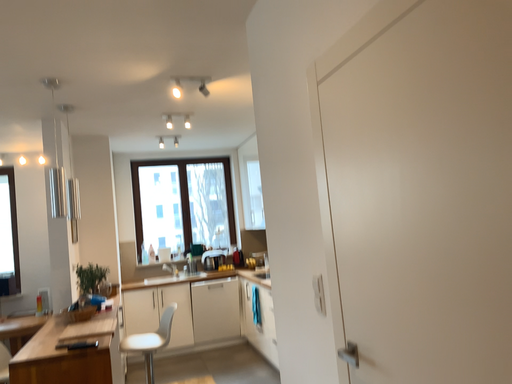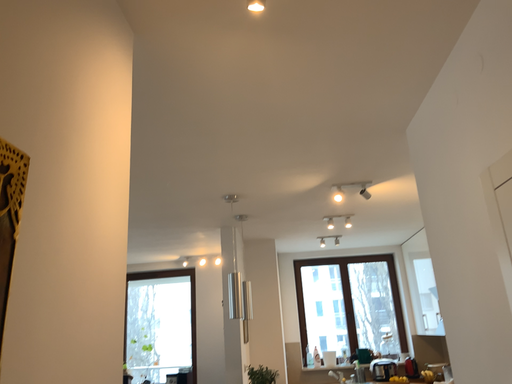
Question: Which way did the camera rotate in the video?

Choices:
 (A) rotated downward
 (B) rotated upward

Answer: (B)